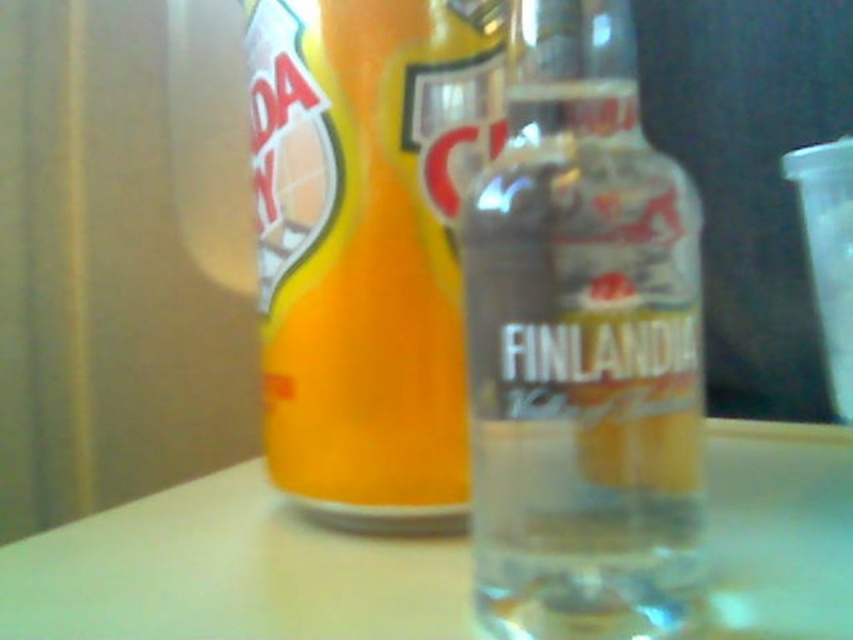
Question: Which of the following is the closest to the observer?

Choices:
 (A) clear glass bottle at center
 (B) transparent plastic shot glass at upper right

Answer: (A)

Question: Is clear glass bottle at center to the right of transparent plastic shot glass at upper right from the viewer's perspective?

Choices:
 (A) yes
 (B) no

Answer: (B)

Question: Which object is positioned farthest from the orange matte can at center?

Choices:
 (A) transparent plastic shot glass at upper right
 (B) clear glass bottle at center
 (C) white glossy table at center

Answer: (A)

Question: Does orange matte can at center have a greater width compared to transparent plastic shot glass at upper right?

Choices:
 (A) no
 (B) yes

Answer: (B)

Question: Which object is positioned closest to the transparent plastic shot glass at upper right?

Choices:
 (A) orange matte can at center
 (B) white glossy table at center

Answer: (B)

Question: Does orange matte can at center appear on the left side of transparent plastic shot glass at upper right?

Choices:
 (A) yes
 (B) no

Answer: (A)